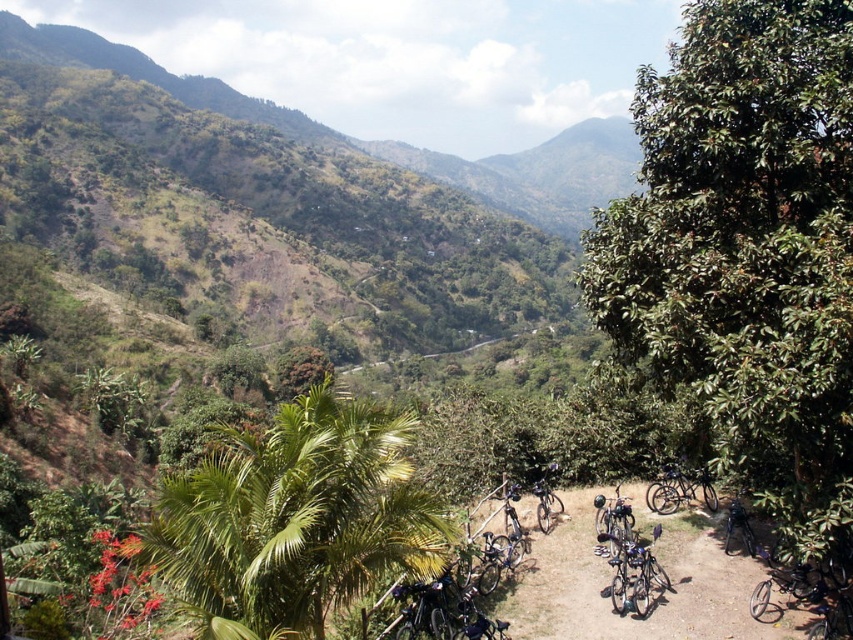
Question: Which of the following is the farthest from the observer?

Choices:
 (A) green leafy palm at center
 (B) green leafy tree at right
 (C) metallic silver bicycles at lower right

Answer: (C)

Question: Does metallic silver bicycles at lower right come behind shiny metallic bicycle at center-right?

Choices:
 (A) no
 (B) yes

Answer: (A)

Question: Estimate the real-world distances between objects in this image. Which object is farther from the green leafy tree at right?

Choices:
 (A) green leafy palm at center
 (B) metallic silver bicycles at lower right

Answer: (A)

Question: Which point is closer to the camera?

Choices:
 (A) shiny metallic bicycle at center-right
 (B) green leafy palm at center
 (C) metallic silver bicycles at lower right

Answer: (B)

Question: From the image, what is the correct spatial relationship of green leafy palm at center in relation to metallic silver bicycles at lower right?

Choices:
 (A) left
 (B) right

Answer: (A)

Question: Is green leafy tree at right to the right of metallic silver bicycles at lower right from the viewer's perspective?

Choices:
 (A) no
 (B) yes

Answer: (B)